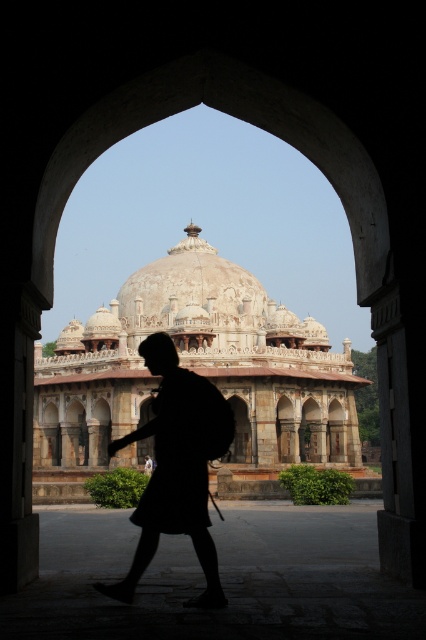
You are standing in front of the arched doorway and need to reach the white stone dome at center. There is a black matte backpack at center blocking your path. Can you walk around it without getting too close? Please consider the distance between them.

The white stone dome at center and black matte backpack at center are 17.56 meters apart. Since the backpack is much smaller than the dome, you can easily walk around it while maintaining a safe distance of about 17 meters between yourself and the dome.

You are standing in front of the arched doorway and want to take a photo of the white stone dome at center. Based on its position, where should you aim your camera to capture it properly?

The white stone dome at center is located at coordinates point [195,371], so aim your camera slightly to the right and up from the center to capture it properly.

You are standing in front of the arched doorway and see both the white stone dome at center and the black matte backpack at center. Which object is positioned to the right side from your perspective?

The white stone dome at center is to the right of the black matte backpack at center, so from your perspective, the white stone dome at center is positioned to the right side.